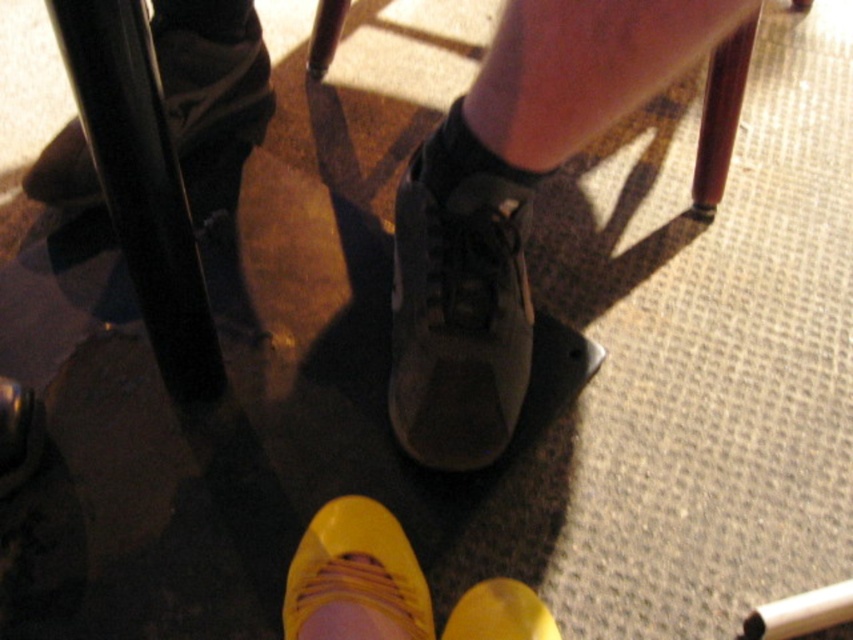
Between matte black shoe at lower left and shiny black shoe at lower center, which one is positioned lower?

shiny black shoe at lower center is lower down.

Which is behind, point (219, 112) or point (12, 451)?

The point (219, 112) is more distant.

The width and height of the screenshot is (853, 640). Find the location of `matte black shoe at lower left`. matte black shoe at lower left is located at coordinates (207, 61).

Is point (459, 280) positioned behind point (374, 531)?

Yes.

Is point (508, 280) in front of point (329, 515)?

No.

Image resolution: width=853 pixels, height=640 pixels. What are the coordinates of `matte black sneaker at center` in the screenshot? It's located at (457, 304).

Does matte black shoe at lower left appear on the right side of yellow suede shoe at lower center?

No, matte black shoe at lower left is not to the right of yellow suede shoe at lower center.

Is matte black shoe at lower left behind yellow suede shoe at lower center?

Yes, matte black shoe at lower left is behind yellow suede shoe at lower center.

What are the coordinates of `matte black shoe at lower left` in the screenshot? It's located at pos(207,61).

At what (x,y) coordinates should I click in order to perform the action: click on matte black shoe at lower left. Please return your answer as a coordinate pair (x, y). The width and height of the screenshot is (853, 640). Looking at the image, I should click on (207, 61).